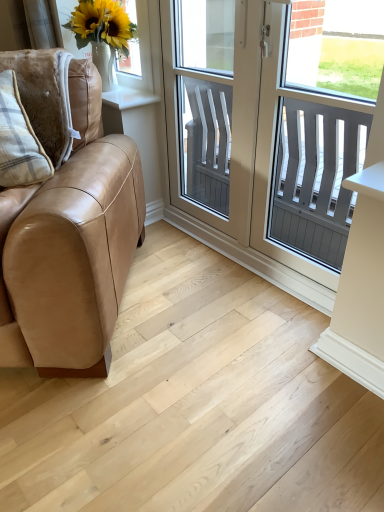
Question: Considering the positions of point (249, 37) and point (122, 154), is point (249, 37) closer or farther from the camera than point (122, 154)?

Choices:
 (A) farther
 (B) closer

Answer: (B)

Question: In the image, is white plastic window at center positioned in front of or behind tan leather couch at left?

Choices:
 (A) front
 (B) behind

Answer: (B)

Question: Which object is the farthest from the clear glass screen door at center?

Choices:
 (A) white matte vase at upper left
 (B) tan leather couch at left
 (C) plaid fabric pillow at left
 (D) light wood floor at lower left
 (E) white plastic window at center

Answer: (E)

Question: Based on their relative distances, which object is farther from the white matte vase at upper left?

Choices:
 (A) white plastic window at center
 (B) light wood floor at lower left
 (C) clear glass screen door at center
 (D) tan leather couch at left
 (E) plaid fabric pillow at left

Answer: (A)